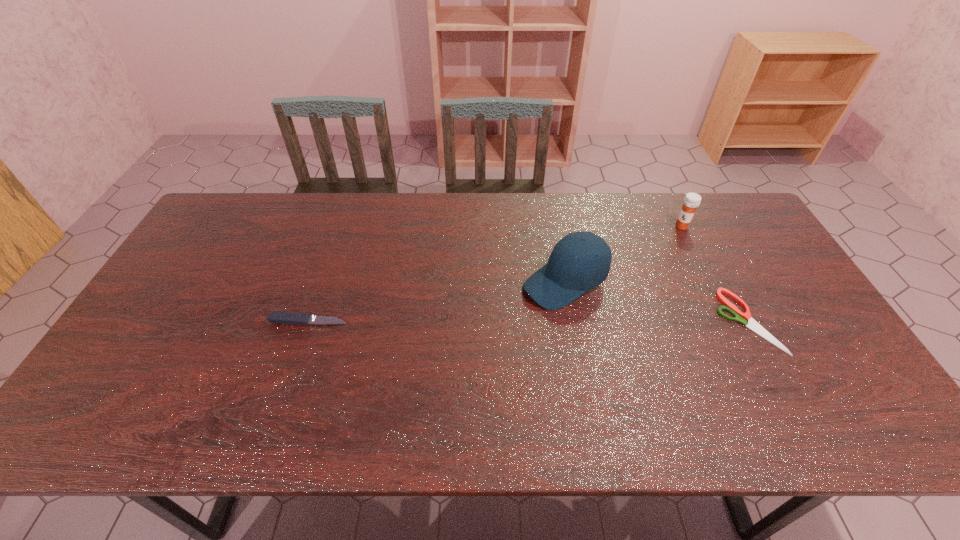
At what (x,y) coordinates should I click in order to perform the action: click on free space on the desktop that is between the leftmost object and the shortest object and is positioned on the front-facing side of the tallest object. Please return your answer as a coordinate pair (x, y). This screenshot has width=960, height=540. Looking at the image, I should click on (488, 321).

Locate an element on the screen. free spot on the desktop that is between the second shortest object and the shortest object and is positioned on the label side of the farthest object is located at coordinates (572, 321).